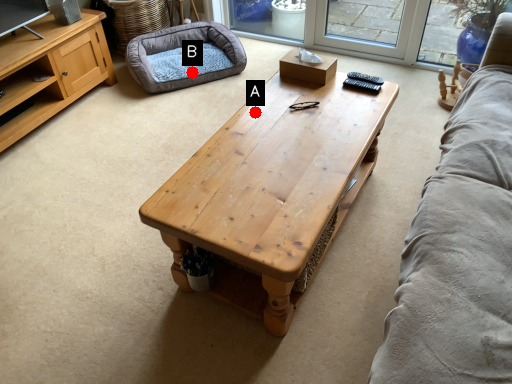
Question: Two points are circled on the image, labeled by A and B beside each circle. Which of the following is the farthest from the observer?

Choices:
 (A) A is further
 (B) B is further

Answer: (B)